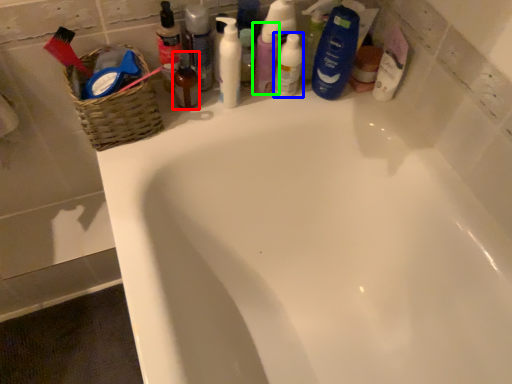
Question: Estimate the real-world distances between objects in this image. Which object is farther from toiletry (highlighted by a red box), mouthwash (highlighted by a blue box) or toiletry (highlighted by a green box)?

Choices:
 (A) mouthwash
 (B) toiletry

Answer: (A)